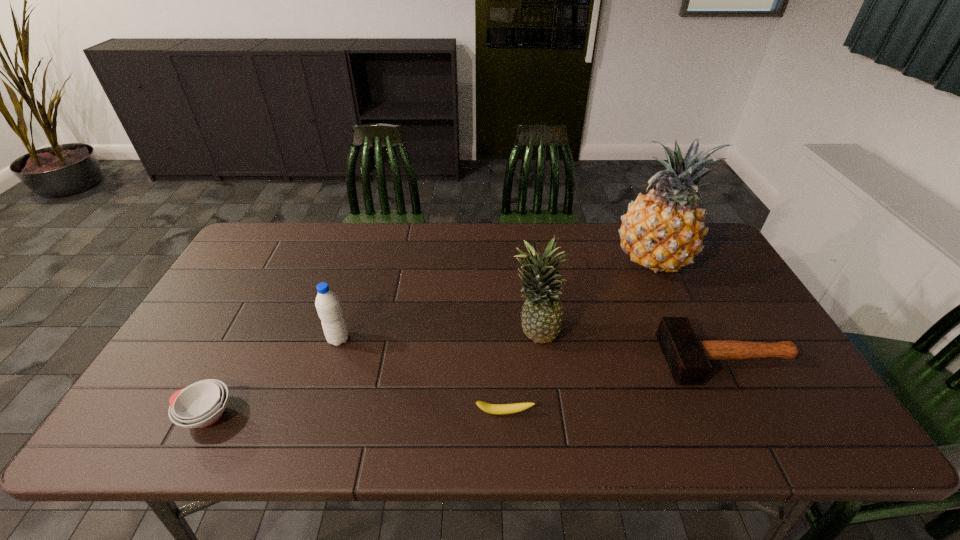
Where is `free point located on the front of the farthest object`? The height and width of the screenshot is (540, 960). free point located on the front of the farthest object is located at coordinates (674, 306).

Locate an element on the screen. The image size is (960, 540). vacant position located 0.260m on the right of the second tallest object is located at coordinates (658, 332).

The image size is (960, 540). I want to click on vacant space located 0.170m on the right of the fifth object from right to left, so click(x=414, y=339).

Where is `vacant space located on the hammer head face of the mallet`? This screenshot has width=960, height=540. vacant space located on the hammer head face of the mallet is located at coordinates (542, 359).

Locate an element on the screen. This screenshot has height=540, width=960. vacant region located 0.250m on the hammer head face of the mallet is located at coordinates (566, 359).

The width and height of the screenshot is (960, 540). What are the coordinates of `free location located 0.360m on the hammer head face of the mallet` in the screenshot? It's located at (523, 359).

Locate an element on the screen. This screenshot has height=540, width=960. vacant area located on the back of the fifth tallest object is located at coordinates (267, 299).

Where is `vacant space situated 0.070m on the upward curve of the banana`? vacant space situated 0.070m on the upward curve of the banana is located at coordinates (506, 446).

Find the location of `object that is at the far edge`. object that is at the far edge is located at coordinates (663, 231).

Image resolution: width=960 pixels, height=540 pixels. In order to click on soup bowl located at the near edge in this screenshot , I will do `click(201, 404)`.